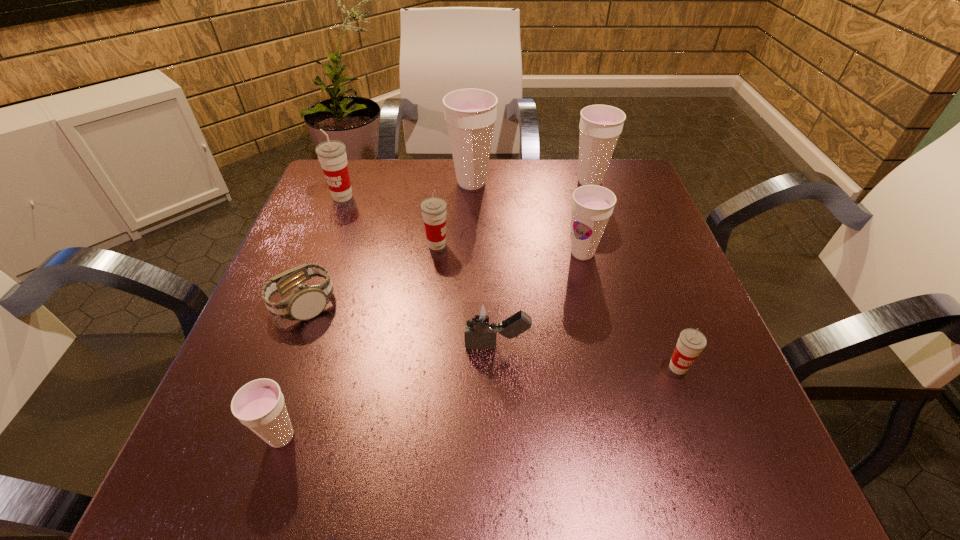
In order to click on the second nearest cup in this screenshot , I will do `click(691, 342)`.

This screenshot has height=540, width=960. I want to click on the nearest purple cup, so click(x=259, y=405).

You are a GUI agent. You are given a task and a screenshot of the screen. Output one action in this format:
    pyautogui.click(x=<x>, y=<y>)
    Task: Click on the smallest purple cup
    The image size is (960, 540).
    Given the screenshot: What is the action you would take?
    pyautogui.click(x=259, y=405)

Where is `the shortest object`? the shortest object is located at coordinates (306, 301).

Find the location of `white watch`. white watch is located at coordinates (306, 301).

Identify the location of vacant space positioned 0.370m on the right of the third purple cup from right to left. This screenshot has width=960, height=540. (640, 183).

Find the location of a particular element. This screenshot has height=540, width=960. vacant region located on the front of the third smallest purple cup is located at coordinates (597, 205).

Image resolution: width=960 pixels, height=540 pixels. Identify the location of vacant space located on the side of the biggest red cup with the logo. (290, 334).

I want to click on free space located on the side of the second biggest red cup with the logo, so click(x=500, y=245).

Locate an element on the screen. vacant area situated on the right of the third biggest purple cup is located at coordinates (639, 253).